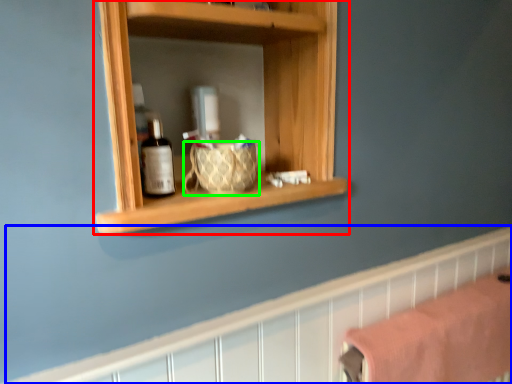
Question: Which object is positioned closest to shelf (highlighted by a red box)? Select from ledge (highlighted by a blue box) and basket (highlighted by a green box).

Choices:
 (A) ledge
 (B) basket

Answer: (B)